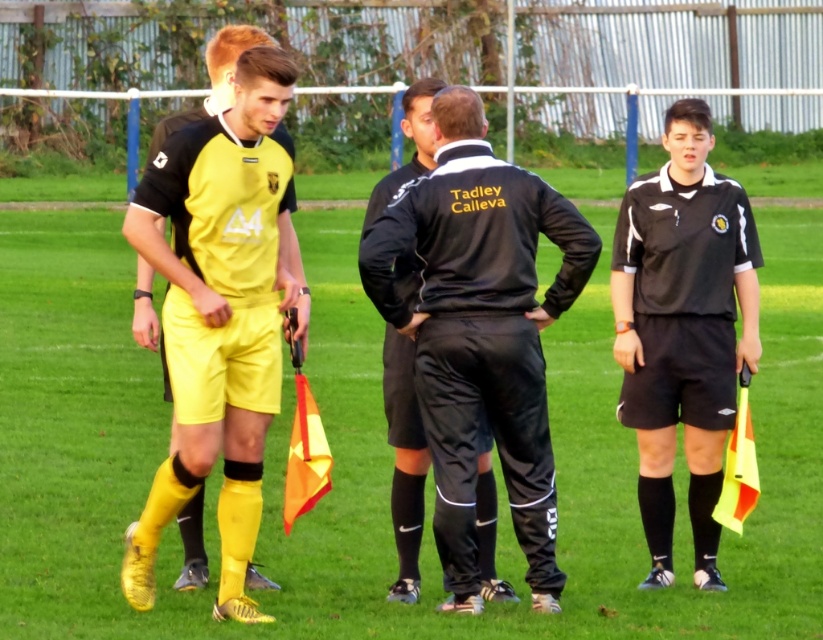
Question: Can you confirm if black matte jacket at center is positioned to the left of black matte referee uniform at right?

Choices:
 (A) no
 (B) yes

Answer: (B)

Question: Estimate the real-world distances between objects in this image. Which object is closer to the black matte referee uniform at right?

Choices:
 (A) matte yellow shorts at left
 (B) black matte jacket at center

Answer: (B)

Question: Based on their relative distances, which object is farther from the matte yellow shorts at left?

Choices:
 (A) black matte referee uniform at right
 (B) yellow matte shorts at left
 (C) black matte jacket at center

Answer: (A)

Question: Among these objects, which one is farthest from the camera?

Choices:
 (A) black matte referee uniform at right
 (B) matte yellow shorts at left

Answer: (A)

Question: Is black matte referee uniform at right smaller than matte yellow shorts at left?

Choices:
 (A) no
 (B) yes

Answer: (A)

Question: Can you confirm if black matte referee uniform at right is smaller than matte yellow shorts at left?

Choices:
 (A) no
 (B) yes

Answer: (A)